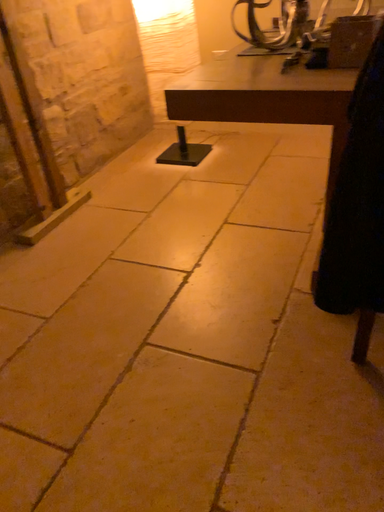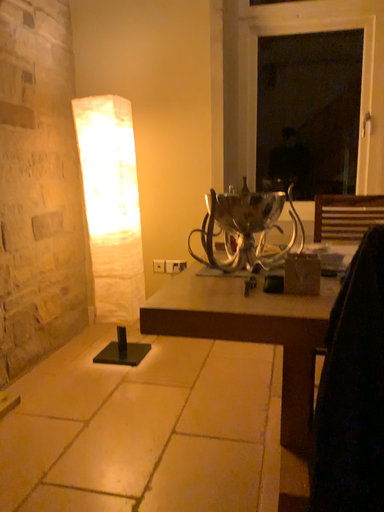
Question: How did the camera likely rotate when shooting the video?

Choices:
 (A) rotated downward
 (B) rotated upward

Answer: (B)